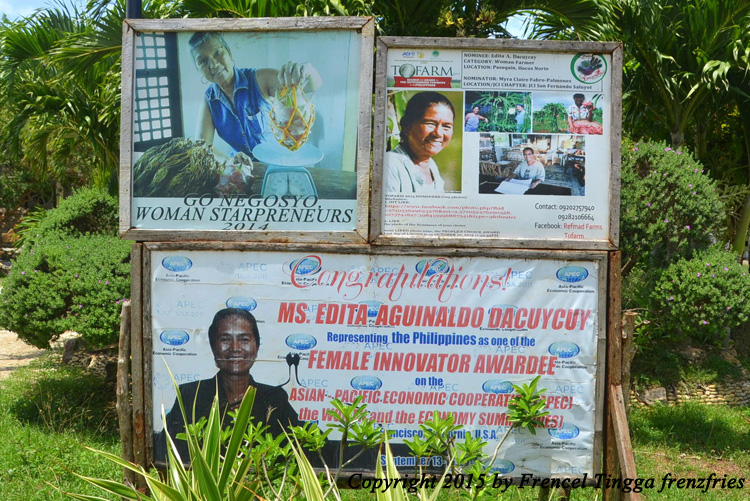
Where is `frame`? Image resolution: width=750 pixels, height=501 pixels. frame is located at coordinates (633, 449), (370, 245), (115, 229), (469, 42), (343, 23).